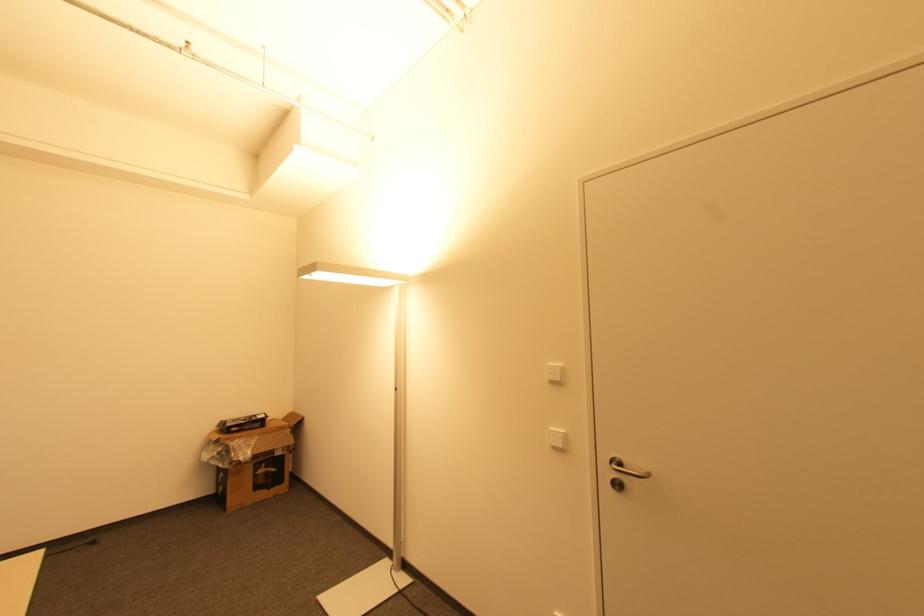
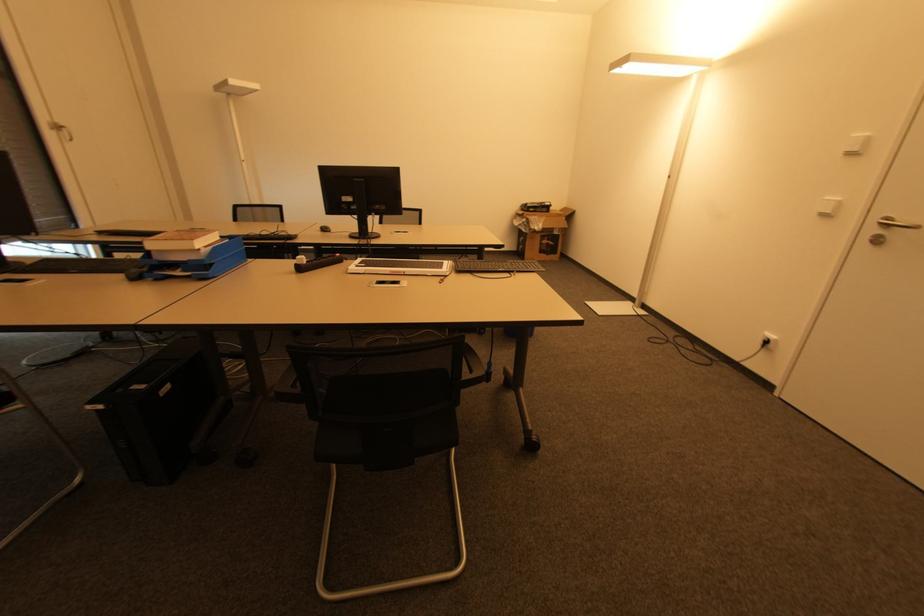
Where in the second image is the point corresponding to the point at 268,472 from the first image?

(550, 245)